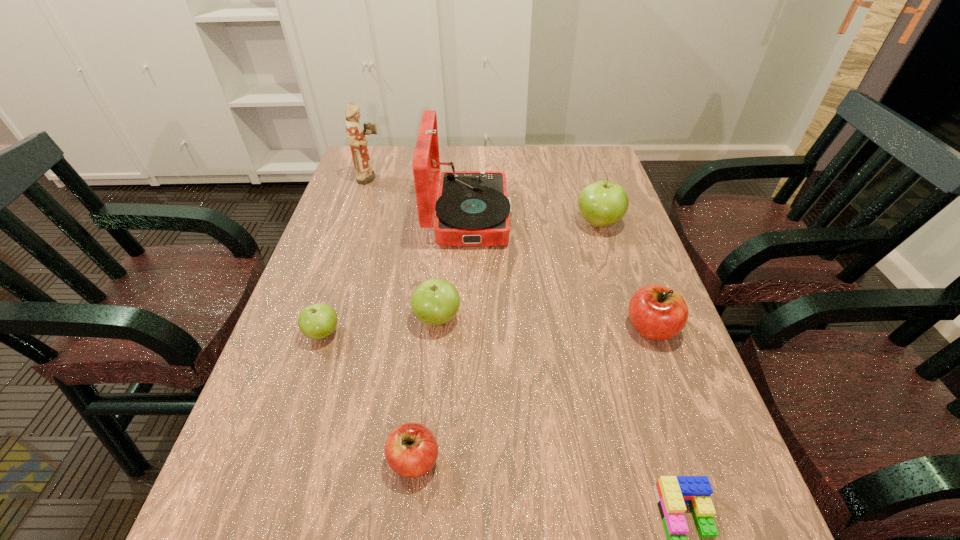
I want to click on phonograph_record, so click(x=473, y=208).

At what (x,y) coordinates should I click in order to perform the action: click on the farthest object. Please return your answer as a coordinate pair (x, y). The height and width of the screenshot is (540, 960). Looking at the image, I should click on (356, 136).

What are the coordinates of `the rightmost green apple` in the screenshot? It's located at (602, 203).

At what (x,y) coordinates should I click in order to perform the action: click on the farthest green apple. Please return your answer as a coordinate pair (x, y). Image resolution: width=960 pixels, height=540 pixels. Looking at the image, I should click on (602, 203).

You are a GUI agent. You are given a task and a screenshot of the screen. Output one action in this format:
    pyautogui.click(x=<x>, y=<y>)
    Task: Click on the second green apple from right to left
    
    Given the screenshot: What is the action you would take?
    pyautogui.click(x=434, y=302)

Where is `the bigger red apple`? The height and width of the screenshot is (540, 960). the bigger red apple is located at coordinates (656, 312).

The height and width of the screenshot is (540, 960). What are the coordinates of `the right red apple` in the screenshot? It's located at (656, 312).

Locate an element on the screen. Image resolution: width=960 pixels, height=540 pixels. the leftmost apple is located at coordinates (317, 321).

Locate an element on the screen. the leftmost green apple is located at coordinates (317, 321).

The height and width of the screenshot is (540, 960). Find the location of `the seventh farthest object`. the seventh farthest object is located at coordinates (411, 450).